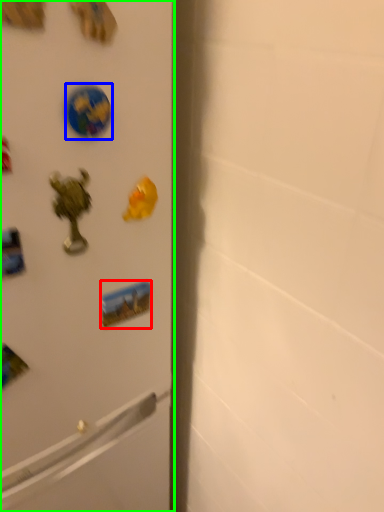
Question: Which object is positioned closest to sticker (highlighted by a red box)? Select from sticker (highlighted by a blue box) and refrigerator (highlighted by a green box).

Choices:
 (A) sticker
 (B) refrigerator

Answer: (B)